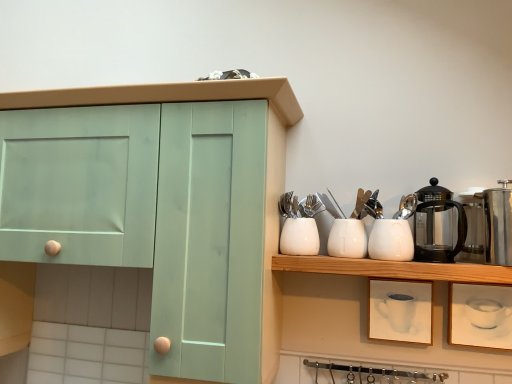
Question: From the image's perspective, would you say white glossy kettle at upper right, the third appliance when ordered from right to left, is shown under black glass coffee pot at upper right?

Choices:
 (A) no
 (B) yes

Answer: (B)

Question: Is white glossy kettle at upper right, the third appliance when ordered from right to left, closer to camera compared to black glass coffee pot at upper right?

Choices:
 (A) yes
 (B) no

Answer: (B)

Question: Is white glossy kettle at upper right, which is the 1th appliance in left-to-right order, oriented towards black glass coffee pot at upper right?

Choices:
 (A) yes
 (B) no

Answer: (B)

Question: Is white glossy kettle at upper right, which is the 1th appliance in left-to-right order, behind black glass coffee pot at upper right?

Choices:
 (A) yes
 (B) no

Answer: (A)

Question: Considering the relative positions of white glossy kettle at upper right, which is the 1th appliance in left-to-right order, and black glass coffee pot at upper right in the image provided, is white glossy kettle at upper right, which is the 1th appliance in left-to-right order, to the left of black glass coffee pot at upper right from the viewer's perspective?

Choices:
 (A) no
 (B) yes

Answer: (B)

Question: Considering the positions of silver metallic forks at upper center and clear glass carafe at upper right, placed as the second appliance when sorted from left to right, in the image, is silver metallic forks at upper center wider or thinner than clear glass carafe at upper right, placed as the second appliance when sorted from left to right,?

Choices:
 (A) thin
 (B) wide

Answer: (A)

Question: Considering the positions of point (315, 206) and point (480, 218), is point (315, 206) closer or farther from the camera than point (480, 218)?

Choices:
 (A) farther
 (B) closer

Answer: (A)

Question: Based on their sizes in the image, would you say silver metallic forks at upper center is bigger or smaller than clear glass carafe at upper right, the 2th appliance positioned from the right?

Choices:
 (A) small
 (B) big

Answer: (A)

Question: From the image's perspective, is silver metallic forks at upper center above or below clear glass carafe at upper right, the 2th appliance positioned from the right?

Choices:
 (A) above
 (B) below

Answer: (A)

Question: Considering the positions of silver metallic forks at upper center and white glossy kettle at upper right, which is the 1th appliance in left-to-right order, in the image, is silver metallic forks at upper center wider or thinner than white glossy kettle at upper right, which is the 1th appliance in left-to-right order,?

Choices:
 (A) thin
 (B) wide

Answer: (A)

Question: Is silver metallic forks at upper center bigger or smaller than white glossy kettle at upper right, which is the 1th appliance in left-to-right order?

Choices:
 (A) big
 (B) small

Answer: (B)

Question: Is silver metallic forks at upper center situated inside white glossy kettle at upper right, which is the 1th appliance in left-to-right order, or outside?

Choices:
 (A) outside
 (B) inside

Answer: (A)

Question: Is point 318,205 positioned closer to the camera than point 397,223?

Choices:
 (A) farther
 (B) closer

Answer: (A)

Question: From the image's perspective, relative to black glass coffee pot at upper right, is white glossy container at center, the 2th tableware in the left-to-right sequence, above or below?

Choices:
 (A) below
 (B) above

Answer: (A)

Question: Looking at their shapes, would you say white glossy container at center, the 2th tableware in the left-to-right sequence, is wider or thinner than black glass coffee pot at upper right?

Choices:
 (A) wide
 (B) thin

Answer: (B)